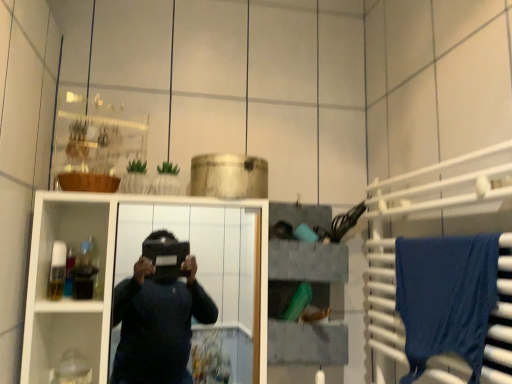
You are a GUI agent. You are given a task and a screenshot of the screen. Output one action in this format:
    pyautogui.click(x=<x>, y=<y>)
    Task: Click on the blue fabric at right
    This screenshot has width=512, height=384.
    Given the screenshot: What is the action you would take?
    pyautogui.click(x=426, y=216)

This screenshot has width=512, height=384. I want to click on white glossy cabinet at center, so click(x=132, y=272).

Considering the positions of points (268, 249) and (397, 255), is point (268, 249) closer to camera compared to point (397, 255)?

No.

From a real-world perspective, who is located higher, gray fabric storage at upper center or blue fabric towel at right?

gray fabric storage at upper center.

Is gray fabric storage at upper center positioned behind blue fabric towel at right?

Yes, gray fabric storage at upper center is further from the camera.

Considering the sizes of gray fabric storage at upper center and blue fabric towel at right in the image, is gray fabric storage at upper center taller or shorter than blue fabric towel at right?

gray fabric storage at upper center is taller than blue fabric towel at right.

Consider the image. From a real-world perspective, which is physically below, blue fabric at right or white glossy cabinet at center?

From a 3D spatial view, white glossy cabinet at center is below.

Relative to white glossy cabinet at center, is blue fabric at right in front or behind?

blue fabric at right is positioned closer to the viewer than white glossy cabinet at center.

From the image's perspective, is blue fabric at right above white glossy cabinet at center?

Correct, blue fabric at right appears higher than white glossy cabinet at center in the image.

I want to click on cabinetry that appears below the blue fabric at right (from the image's perspective), so click(x=132, y=272).

From the picture: Which object is positioned more to the right, white glossy cabinet at center or blue fabric at right?

From the viewer's perspective, blue fabric at right appears more on the right side.

At what (x,y) coordinates should I click in order to perform the action: click on cabinet located above the white glossy cabinet at center (from a real-world perspective). Please return your answer as a coordinate pair (x, y). This screenshot has height=384, width=512. Looking at the image, I should click on (426, 216).

Considering the relative positions of white glossy cabinet at center and blue fabric at right in the image provided, is white glossy cabinet at center in front of blue fabric at right?

That is False.

How many degrees apart are the facing directions of white glossy cabinet at center and blue fabric at right?

The angular difference between white glossy cabinet at center and blue fabric at right is 90.5 degrees.

Does white glossy cabinet at center come in front of gray fabric storage at upper center?

Yes, it is.

From a real-world perspective, is white glossy cabinet at center below gray fabric storage at upper center?

Yes, from a real-world perspective, white glossy cabinet at center is below gray fabric storage at upper center.

Is gray fabric storage at upper center surrounded by white glossy cabinet at center?

No, gray fabric storage at upper center is located outside of white glossy cabinet at center.

Does white glossy cabinet at center turn towards gray fabric storage at upper center?

No.

From the image's perspective, does gray fabric storage at upper center appear higher than white glossy cabinet at center?

Correct, gray fabric storage at upper center appears higher than white glossy cabinet at center in the image.

Can you tell me how much gray fabric storage at upper center and white glossy cabinet at center differ in facing direction?

The facing directions of gray fabric storage at upper center and white glossy cabinet at center are 0.542 degrees apart.

Which of these two, gray fabric storage at upper center or white glossy cabinet at center, is bigger?

white glossy cabinet at center.

Is gray fabric storage at upper center facing away from white glossy cabinet at center?

No.

Could you tell me if blue fabric at right is facing blue fabric towel at right?

Yes, blue fabric at right is aimed at blue fabric towel at right.

Find the location of a particular element. bath towel that appears behind the blue fabric at right is located at coordinates (446, 297).

Who is more distant, blue fabric at right or blue fabric towel at right?

blue fabric towel at right is further from the camera.

Between point (454, 380) and point (320, 253), which one is positioned behind?

The point (320, 253) is behind.

Identify the location of shelf that is above the blue fabric at right (from a real-world perspective). The width and height of the screenshot is (512, 384). (310, 302).

Image resolution: width=512 pixels, height=384 pixels. In the image, there is a gray fabric storage at upper center. Identify the location of bath towel below it (from the image's perspective). (446, 297).

Where is `cabinet lying above the white glossy cabinet at center (from the image's perspective)`? The width and height of the screenshot is (512, 384). cabinet lying above the white glossy cabinet at center (from the image's perspective) is located at coordinates (426, 216).

When comparing their distances from gray fabric storage at upper center, does blue fabric at right or white glossy cabinet at center seem further?

white glossy cabinet at center is further to gray fabric storage at upper center.

Estimate the real-world distances between objects in this image. Which object is further from gray fabric storage at upper center, blue fabric at right or blue fabric towel at right?

blue fabric towel at right is further to gray fabric storage at upper center.

From the image, which object appears to be farther from blue fabric towel at right, blue fabric at right or gray fabric storage at upper center?

The object further to blue fabric towel at right is gray fabric storage at upper center.

Estimate the real-world distances between objects in this image. Which object is closer to gray fabric storage at upper center, white glossy cabinet at center or blue fabric towel at right?

The object closer to gray fabric storage at upper center is blue fabric towel at right.

Looking at the image, which one is located further to blue fabric towel at right, white glossy cabinet at center or gray fabric storage at upper center?

Among the two, white glossy cabinet at center is located further to blue fabric towel at right.

Which object lies nearer to the anchor point white glossy cabinet at center, gray fabric storage at upper center or blue fabric towel at right?

gray fabric storage at upper center is closer to white glossy cabinet at center.

Which object lies nearer to the anchor point blue fabric towel at right, gray fabric storage at upper center or blue fabric at right?

The object closer to blue fabric towel at right is blue fabric at right.

From the image, which object appears to be farther from blue fabric at right, white glossy cabinet at center or blue fabric towel at right?

white glossy cabinet at center.

Image resolution: width=512 pixels, height=384 pixels. I want to click on bath towel located between white glossy cabinet at center and blue fabric at right in the left-right direction, so click(446, 297).

At what (x,y) coordinates should I click in order to perform the action: click on shelf between white glossy cabinet at center and blue fabric at right in the horizontal direction. Please return your answer as a coordinate pair (x, y). The height and width of the screenshot is (384, 512). Looking at the image, I should click on (310, 302).

The height and width of the screenshot is (384, 512). In order to click on shelf between white glossy cabinet at center and blue fabric towel at right in this screenshot , I will do `click(310, 302)`.

Where is `bath towel between blue fabric at right and gray fabric storage at upper center from front to back`? The image size is (512, 384). bath towel between blue fabric at right and gray fabric storage at upper center from front to back is located at coordinates (446, 297).